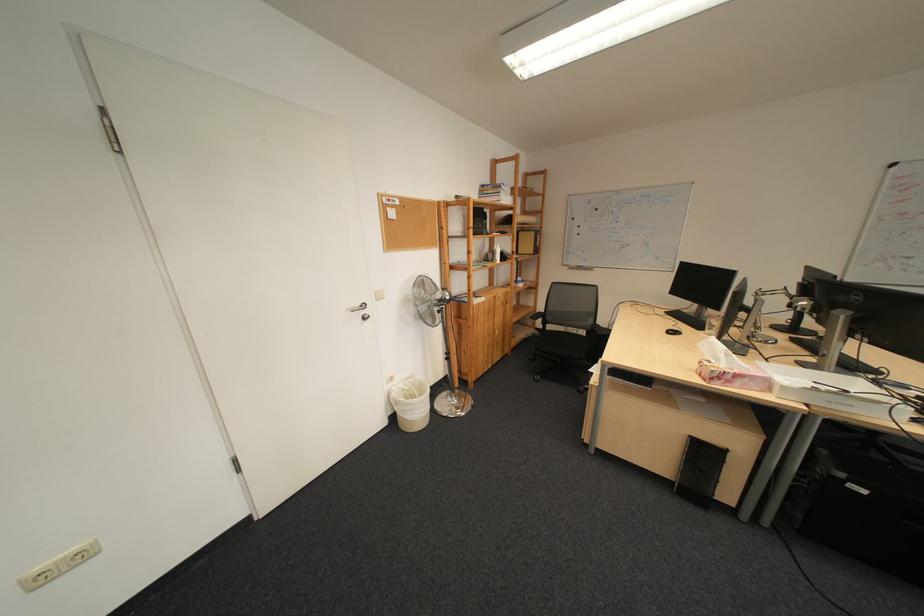
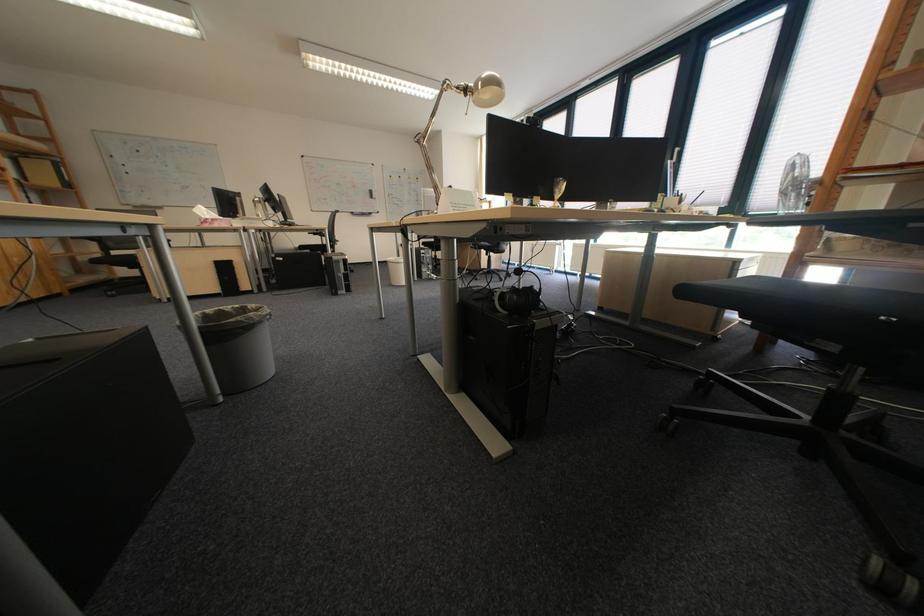
In the second image, find the point that corresponds to (x=743, y=383) in the first image.

(225, 225)